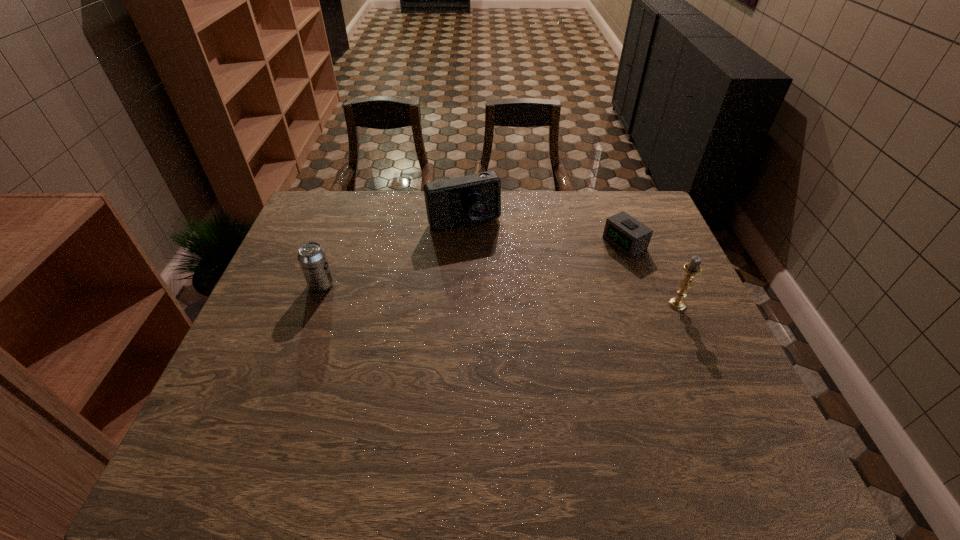
I want to click on the leftmost object, so click(312, 258).

The image size is (960, 540). Identify the location of beer can. (312, 258).

Locate an element on the screen. Image resolution: width=960 pixels, height=540 pixels. candle holder is located at coordinates (692, 269).

I want to click on the third object from right to left, so click(459, 201).

Image resolution: width=960 pixels, height=540 pixels. I want to click on the shortest object, so click(x=630, y=236).

This screenshot has height=540, width=960. I want to click on vacant region located on the right of the second shortest object, so click(x=469, y=285).

Locate an element on the screen. The height and width of the screenshot is (540, 960). free region located 0.070m on the left of the candle holder is located at coordinates (643, 305).

Where is `vacant space located on the front-facing side of the camera`? The height and width of the screenshot is (540, 960). vacant space located on the front-facing side of the camera is located at coordinates (478, 244).

Where is `vacant space situated on the front-facing side of the camera`? The height and width of the screenshot is (540, 960). vacant space situated on the front-facing side of the camera is located at coordinates (503, 297).

Where is `vacant area located 0.290m on the front-facing side of the camera`? Image resolution: width=960 pixels, height=540 pixels. vacant area located 0.290m on the front-facing side of the camera is located at coordinates (503, 297).